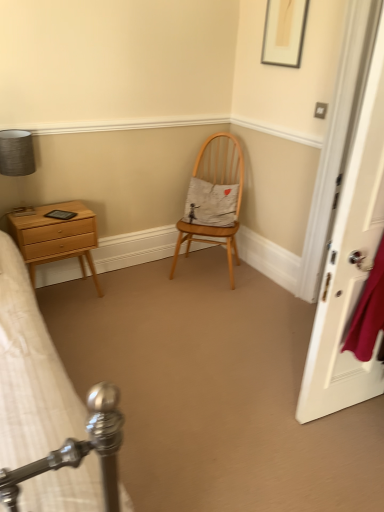
Locate an element on the screen. The width and height of the screenshot is (384, 512). vacant area that lies to the right of matte gray lampshade at upper left is located at coordinates (51, 211).